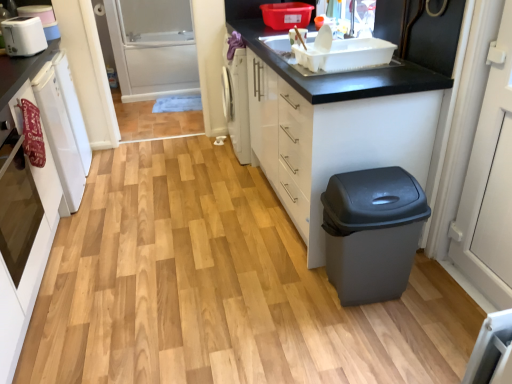
Locate an element on the screen. free space in front of matte gray plastic trash can at lower right is located at coordinates tap(386, 342).